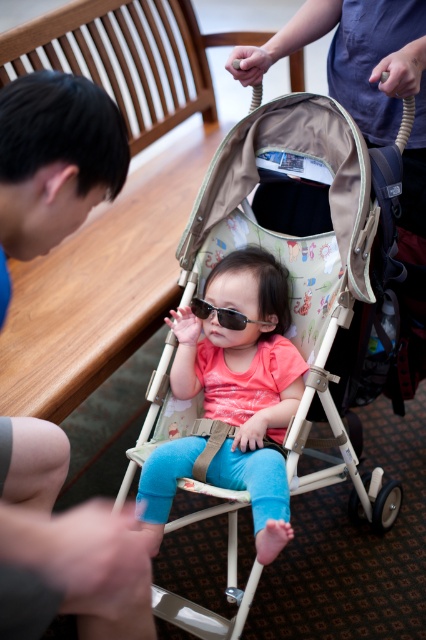
Question: Which of these objects is positioned closest to the blue fabric shirt at left?

Choices:
 (A) sunglasses at center
 (B) matte pink shirt at center
 (C) beige fabric baby carriage at center

Answer: (A)

Question: Is beige fabric baby carriage at center bigger than sunglasses at center?

Choices:
 (A) yes
 (B) no

Answer: (A)

Question: Considering the relative positions of matte pink shirt at center and sunglasses at center in the image provided, where is matte pink shirt at center located with respect to sunglasses at center?

Choices:
 (A) left
 (B) right

Answer: (B)

Question: From the image, what is the correct spatial relationship of blue fabric shirt at left in relation to sunglasses at center?

Choices:
 (A) above
 (B) below

Answer: (A)

Question: Which of these objects is positioned farthest from the beige fabric baby carriage at center?

Choices:
 (A) blue fabric shirt at left
 (B) matte pink shirt at center
 (C) sunglasses at center

Answer: (A)

Question: Which point appears closest to the camera in this image?

Choices:
 (A) (207, 284)
 (B) (5, 458)

Answer: (B)